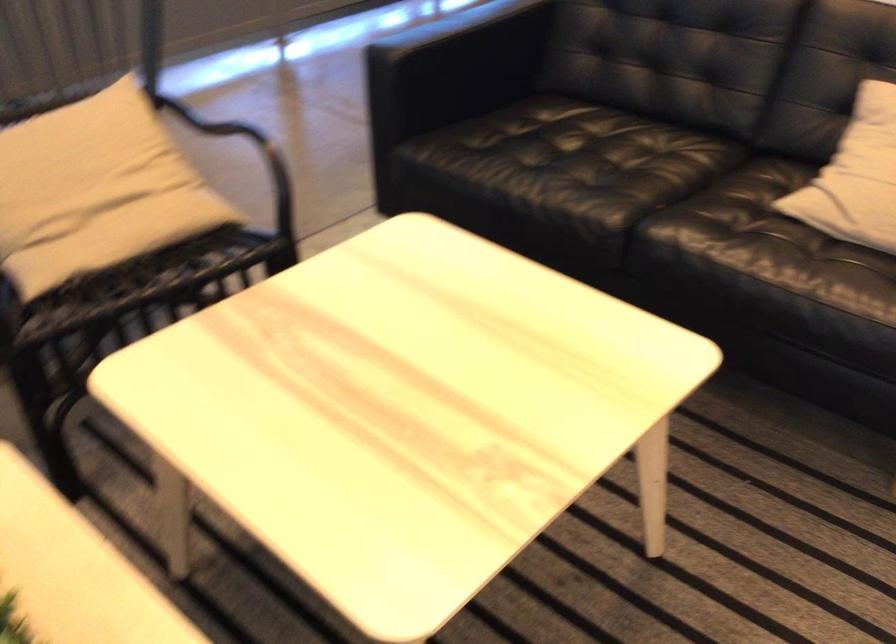
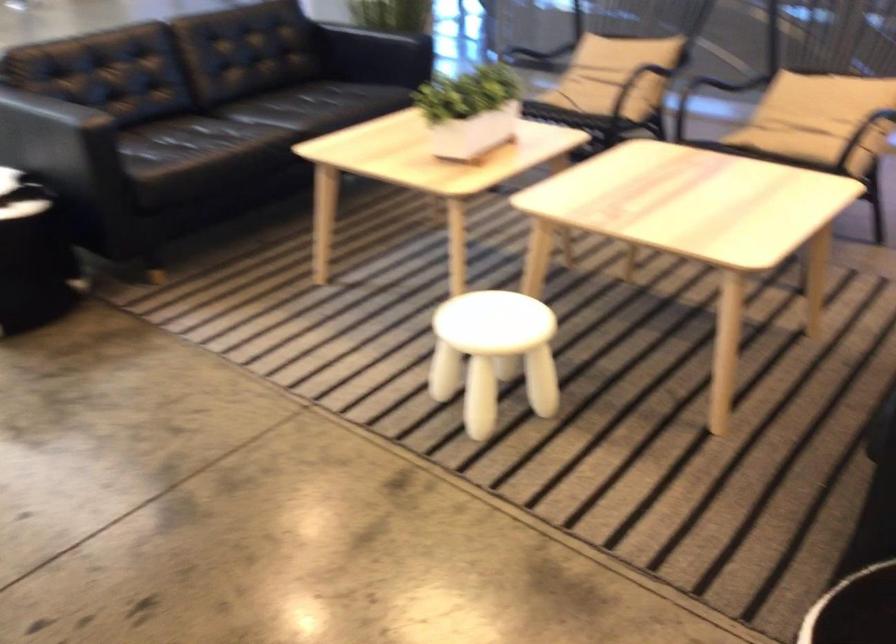
The point at [164,190] is marked in the first image. Where is the corresponding point in the second image?

(817, 118)